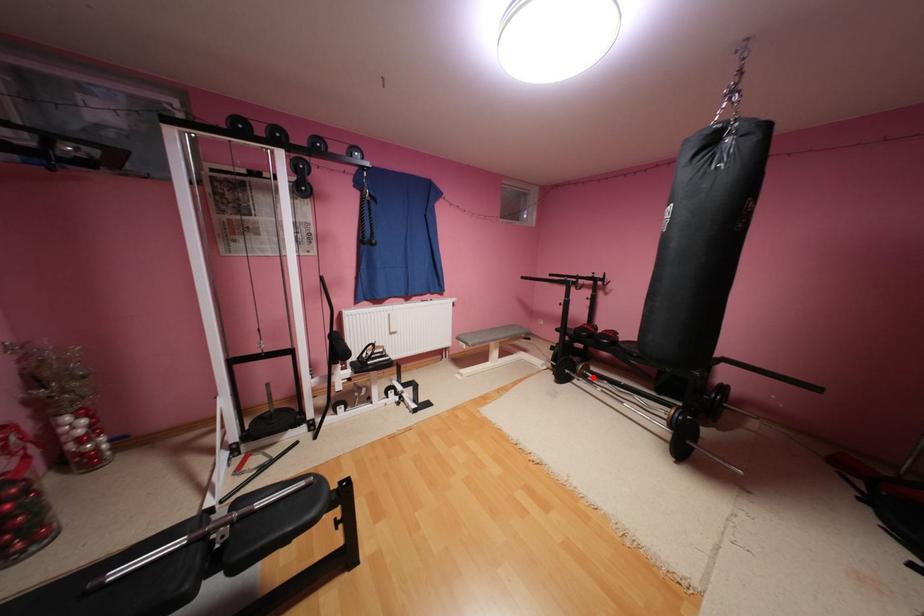
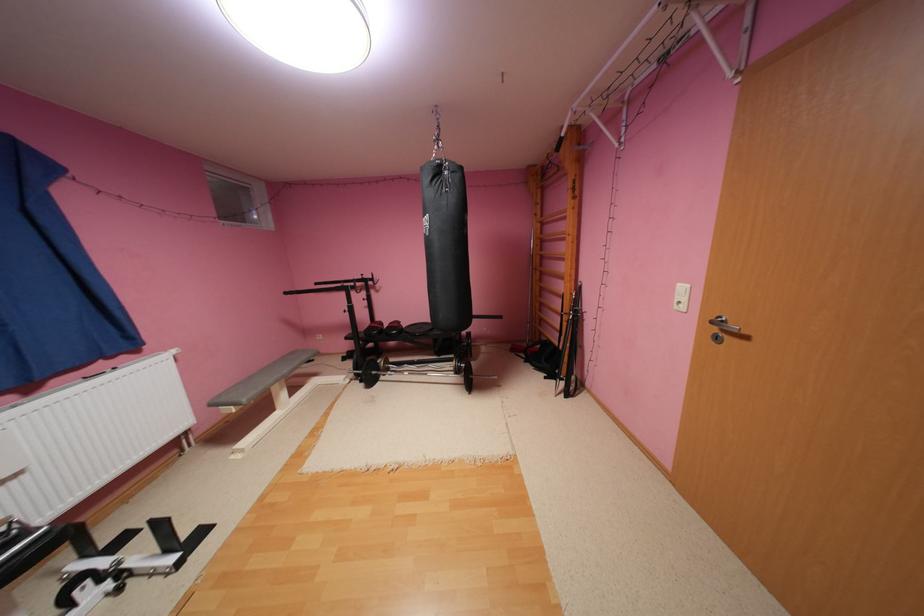
Question: I am providing you with two images of the same scene from different viewpoints. Image1 has a red point marked. In image2, the corresponding 3D location appears at what relative position? Reply with the corresponding letter.

Choices:
 (A) Closer
 (B) Farther

Answer: (A)